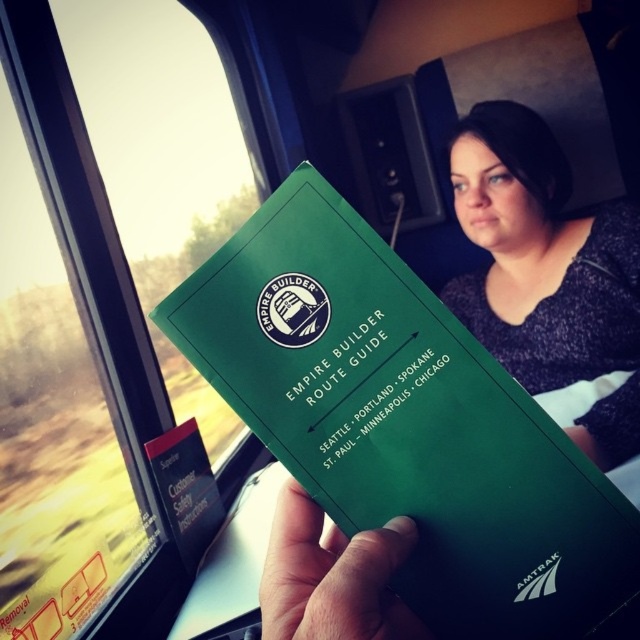
At what (x,y) coordinates should I click in order to perform the action: click on transparent glass train window at left. Please return your answer as a coordinate pair (x, y). Looking at the image, I should click on (99, 284).

Who is shorter, transparent glass train window at left or green matte paper at center?

green matte paper at center is shorter.

Who is more distant from viewer, [74,371] or [397,528]?

The point [74,371] is more distant.

Identify the location of transparent glass train window at left. (99, 284).

Is green paper at center to the left of green matte paper at center from the viewer's perspective?

In fact, green paper at center is to the right of green matte paper at center.

Can you confirm if green paper at center is positioned to the right of green matte paper at center?

Correct, you'll find green paper at center to the right of green matte paper at center.

Is point (474, 618) closer to viewer compared to point (400, 524)?

No, it is behind (400, 524).

You are a GUI agent. You are given a task and a screenshot of the screen. Output one action in this format:
    pyautogui.click(x=<x>, y=<y>)
    Task: Click on the green paper at center
    The width and height of the screenshot is (640, 640).
    Given the screenshot: What is the action you would take?
    pyautogui.click(x=403, y=420)

Does transparent glass train window at left have a lesser height compared to green paper at center?

No.

Consider the image. Who is positioned more to the right, transparent glass train window at left or green paper at center?

Positioned to the right is green paper at center.

Is point (58, 604) in front of point (452, 368)?

No.

You are a GUI agent. You are given a task and a screenshot of the screen. Output one action in this format:
    pyautogui.click(x=<x>, y=<y>)
    Task: Click on the transparent glass train window at left
    The height and width of the screenshot is (640, 640).
    Given the screenshot: What is the action you would take?
    pyautogui.click(x=99, y=284)